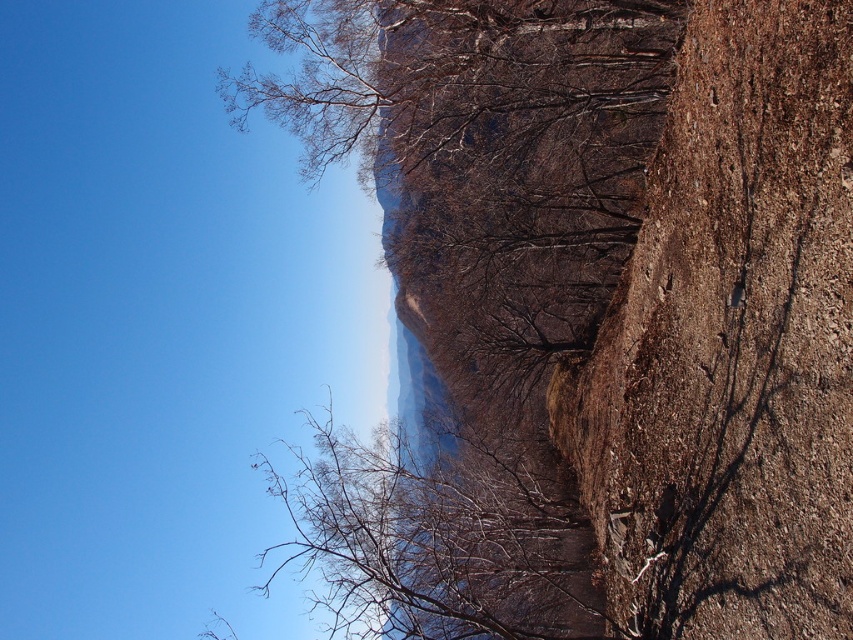
You are an artist sketching this landscape. You want to draw the brown rough rock at right and the bare branches at center. Which object should you sketch first if you follow the standard left to right drawing technique?

You should sketch the bare branches at center first because the brown rough rock at right is positioned on the right side of the bare branches at center, so following left to right drawing technique, you should start with the bare branches at center before moving to the brown rough rock at right.

You are an artist setting up an easel to paint the landscape. You want to capture the brown rough rock at right and the bare branches at center. Which object should you focus on first to ensure proper perspective in your painting?

You should focus on the brown rough rock at right first because it is closer to the viewer than the bare branches at center, so it should be painted with more detail and prominence in the foreground.

You are a hiker standing at the center of the image. You want to place a 1.2 meter tall hiking pole between the brown rough rock at right and the bare branches at center. Can you fit the pole vertically between them without it touching either object?

The brown rough rock at right is shorter than the bare branches at center. Since the pole is 1.2 meters tall, it might touch the taller bare branches at center if placed between them. Therefore, it might not be possible to fit the pole vertically without it touching the bare branches at center.